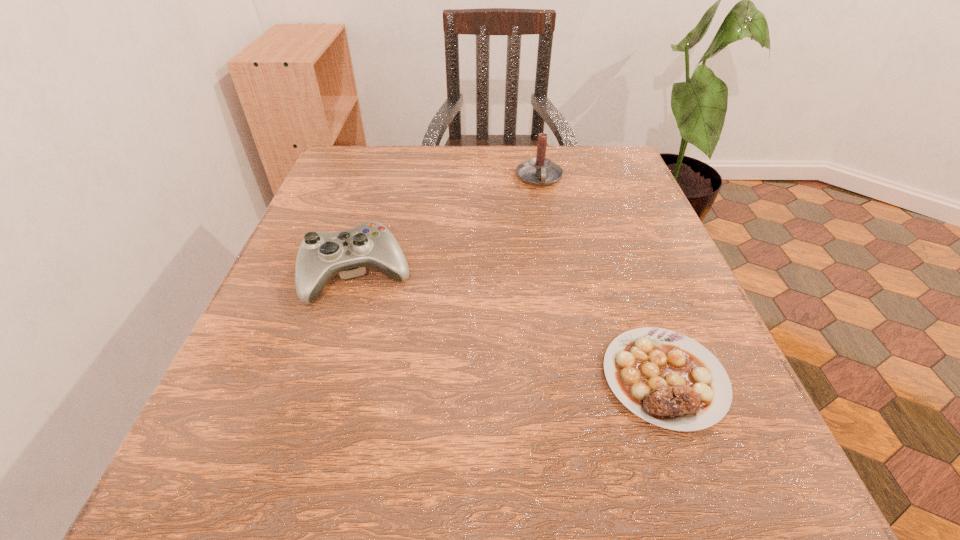
This screenshot has height=540, width=960. I want to click on object present at the left edge, so click(321, 255).

At what (x,y) coordinates should I click in order to perform the action: click on object present at the right edge. Please return your answer as a coordinate pair (x, y). The width and height of the screenshot is (960, 540). Looking at the image, I should click on (664, 377).

Find the location of `vacant space at the far edge of the desktop`. vacant space at the far edge of the desktop is located at coordinates (555, 145).

In the image, there is a desktop. Identify the location of free space at the near edge. (493, 482).

You are a GUI agent. You are given a task and a screenshot of the screen. Output one action in this format:
    pyautogui.click(x=<x>, y=<y>)
    Task: Click on the vacant space at the left edge of the desktop
    Image resolution: width=960 pixels, height=540 pixels.
    Given the screenshot: What is the action you would take?
    pyautogui.click(x=343, y=299)

This screenshot has width=960, height=540. In the image, there is a desktop. What are the coordinates of `vacant region at the right edge` in the screenshot? It's located at (683, 269).

This screenshot has width=960, height=540. In order to click on vacant space at the far left corner of the desktop in this screenshot , I will do `click(334, 169)`.

At what (x,y) coordinates should I click in order to perform the action: click on vacant area at the near left corner. Please return your answer as a coordinate pair (x, y). Image resolution: width=960 pixels, height=540 pixels. Looking at the image, I should click on (261, 456).

I want to click on vacant position at the far right corner of the desktop, so click(566, 157).

You are a GUI agent. You are given a task and a screenshot of the screen. Output one action in this format:
    pyautogui.click(x=<x>, y=<y>)
    Task: Click on the free space at the near right corner
    
    Given the screenshot: What is the action you would take?
    pyautogui.click(x=791, y=501)